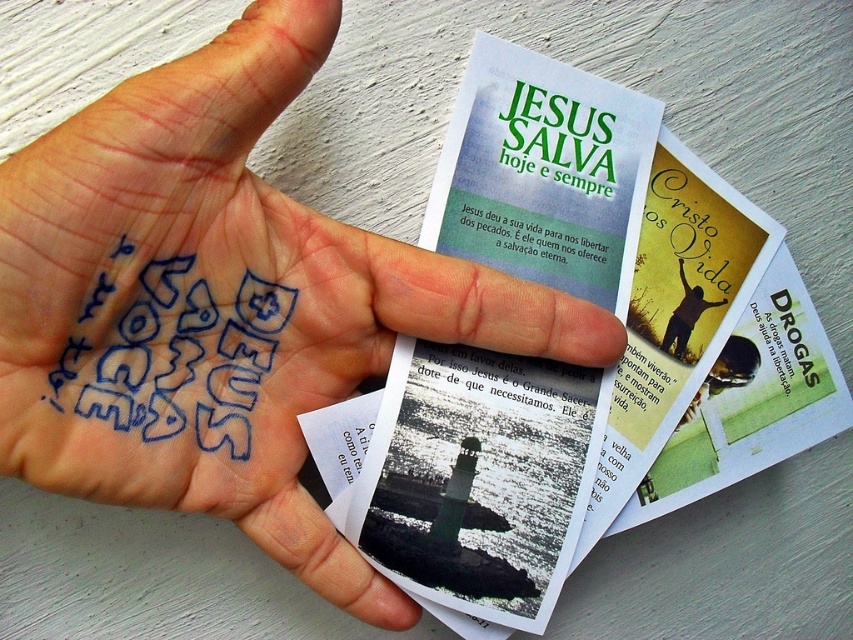
You are a photographer trying to capture a close up of the text on the cards held by the hand. You need to focus your camera lens at a specific distance to ensure clarity. According to the description, what distance should you set your lens focus to in order to capture the point at point (260,540) clearly?

The distance of point (260,540) from the viewer is 20.33 inches, so you should set your lens focus to 20.33 inches to capture it clearly.

You are a graphic designer asked to create a layout that includes both the blue ink palm at center and the black paper text at center. Considering their sizes, which object should be placed first to ensure visibility?

The blue ink palm at center is larger in size than the black paper text at center, so it should be placed first to ensure the smaller black paper text at center remains visible without being overwhelmed.